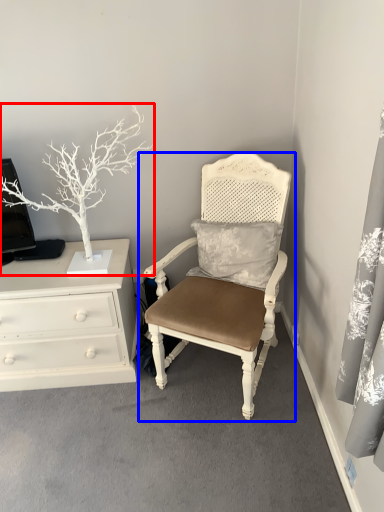
Question: Which object appears closest to the camera in this image, houseplant (highlighted by a red box) or chair (highlighted by a blue box)?

Choices:
 (A) houseplant
 (B) chair

Answer: (B)